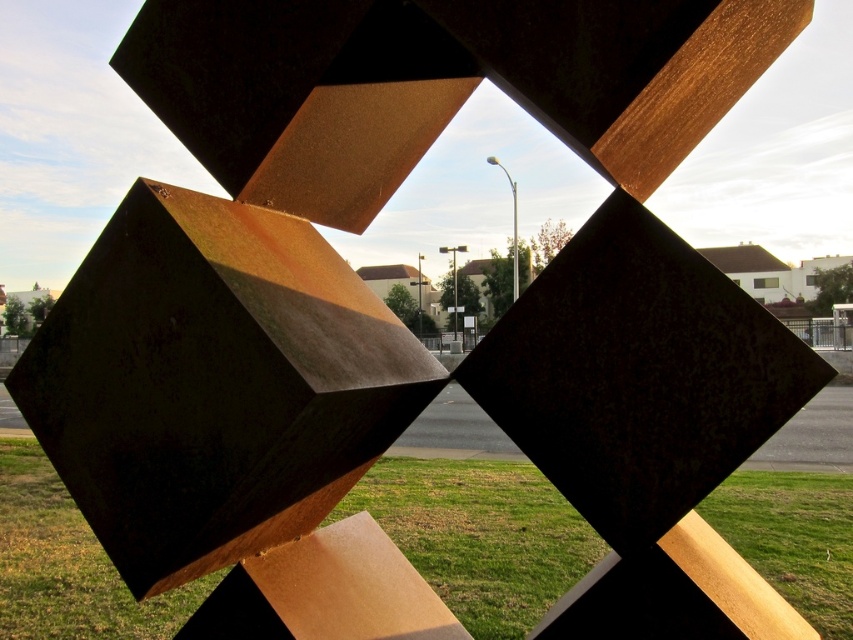
Question: Is green grass at lower center below rusty metal fence at center?

Choices:
 (A) no
 (B) yes

Answer: (B)

Question: Can you confirm if rusty metal fence at center is positioned to the right of rusty metal fence at lower left?

Choices:
 (A) no
 (B) yes

Answer: (B)

Question: Among these objects, which one is farthest from the camera?

Choices:
 (A) green grass at lower center
 (B) rusty metal fence at center

Answer: (B)

Question: Considering the real-world distances, which object is farthest from the rusty metal fence at lower right?

Choices:
 (A) rusty metal fence at center
 (B) green grass at lower center

Answer: (B)

Question: Does green grass at lower center appear under rusty metal fence at lower right?

Choices:
 (A) no
 (B) yes

Answer: (B)

Question: Which point is farther from the camera taking this photo?

Choices:
 (A) (0, 339)
 (B) (440, 333)

Answer: (A)